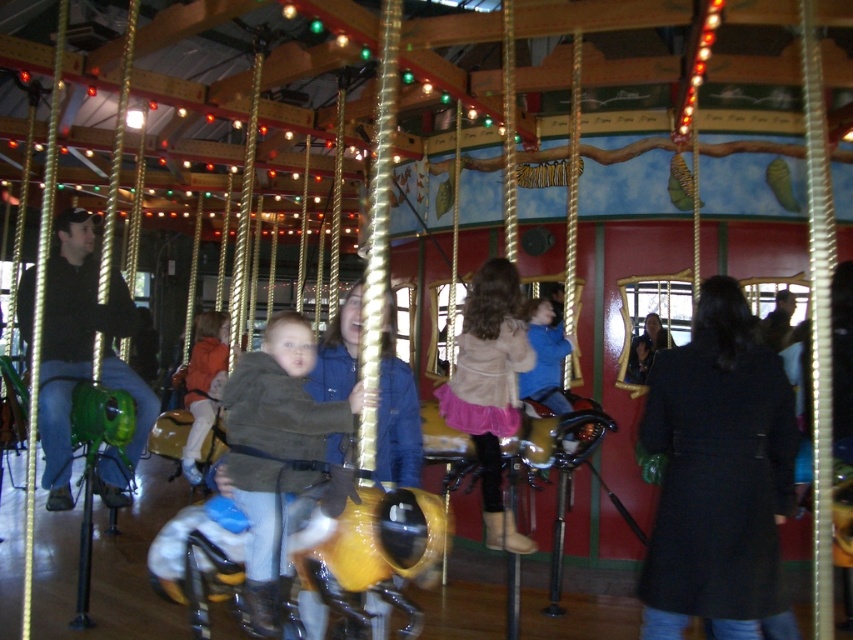
You are standing at the entrance of the carousel and want to place a new decorative item exactly at the center of the carousel. The brown leather jacket at center is currently occupying the desired location. Can you determine if the jacket is exactly at the center based on its coordinates?

The brown leather jacket at center is located at coordinates point (276, 452), which is not exactly the center of the carousel. The center would typically be at coordinates like (426, 320), so the jacket is slightly to the right and above the true center.

In the scene shown: You are a photographer standing at the edge of the carousel floor, and you want to take a photo of both the brown leather jacket at center and the pink satin skirt at center. The minimum distance between the two objects for your camera to focus on both is 1.5 meters. Will your camera be able to capture both in focus?

The brown leather jacket at center and the pink satin skirt at center are 1.43 meters apart from each other. Since the required minimum distance is 1.5 meters, the camera will not be able to focus on both objects as they are closer than the required distance.

You are a visitor at the carousel and want to place your jacket on the floor near the center. Which jacket, the brown leather jacket at center or the orange fleece jacket at center, requires more space because it is larger?

The orange fleece jacket at center requires more space because it is larger than the brown leather jacket at center.